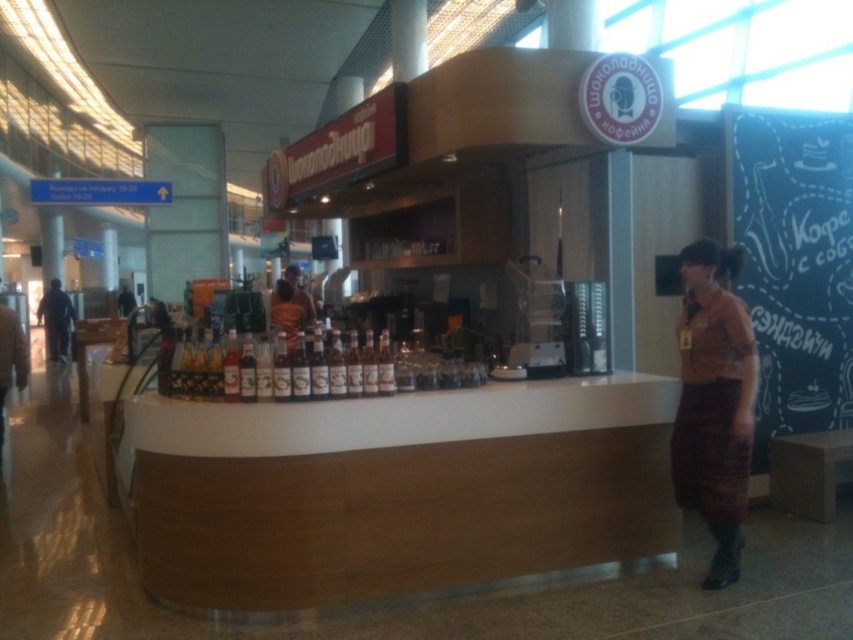
Is dark blue jeans at left smaller than matte brown shirt at center?

Yes, dark blue jeans at left is smaller than matte brown shirt at center.

What do you see at coordinates (56, 320) in the screenshot?
I see `dark blue jeans at left` at bounding box center [56, 320].

Identify the location of dark blue jeans at left. The height and width of the screenshot is (640, 853). (56, 320).

Between translucent glass bottles at center and matte brown shirt at center, which one is positioned higher?

matte brown shirt at center is above.

Between point (457, 358) and point (293, 301), which one is positioned behind?

The point (293, 301) is more distant.

Where is `translucent glass bottles at center`? The image size is (853, 640). translucent glass bottles at center is located at coordinates (432, 364).

Based on the photo, can you confirm if brown woven skirt at right is positioned above wooden table at center?

No.

Is brown woven skirt at right bigger than wooden table at center?

Incorrect, brown woven skirt at right is not larger than wooden table at center.

Describe the element at coordinates (714, 403) in the screenshot. I see `brown woven skirt at right` at that location.

The height and width of the screenshot is (640, 853). Find the location of `brown woven skirt at right`. brown woven skirt at right is located at coordinates (714, 403).